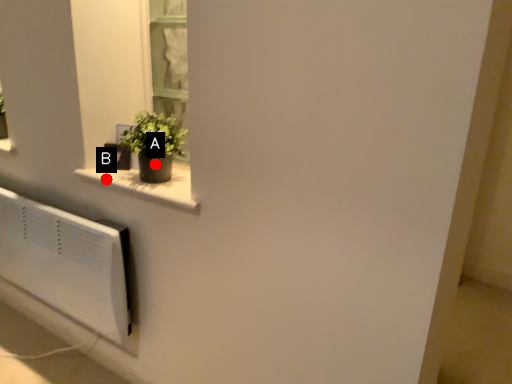
Question: Two points are circled on the image, labeled by A and B beside each circle. Which of the following is the farthest from the observer?

Choices:
 (A) A is further
 (B) B is further

Answer: (B)